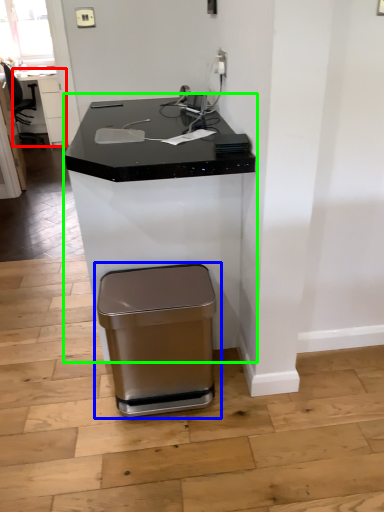
Question: Which is farther away from table (highlighted by a red box)? waste container (highlighted by a blue box) or desk (highlighted by a green box)?

Choices:
 (A) waste container
 (B) desk

Answer: (A)